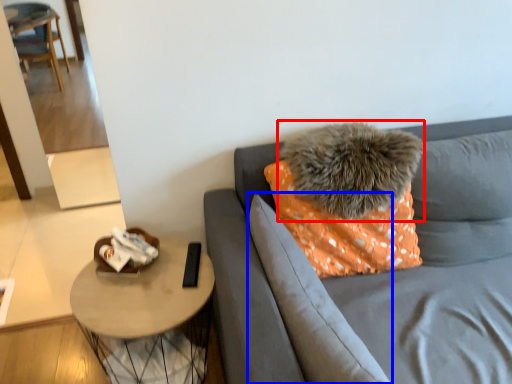
Question: Which of the following is the closest to the observer, pillow (highlighted by a red box) or pillow (highlighted by a blue box)?

Choices:
 (A) pillow
 (B) pillow

Answer: (B)